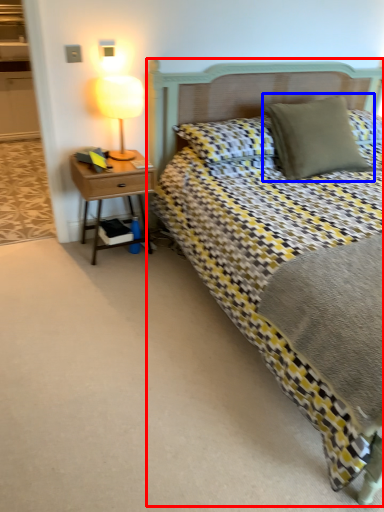
Question: Which point is further to the camera, bed (highlighted by a red box) or pillow (highlighted by a blue box)?

Choices:
 (A) bed
 (B) pillow

Answer: (B)